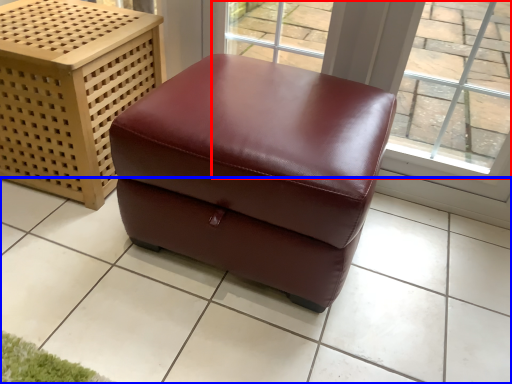
Question: Which object appears closest to the camera in this image, window (highlighted by a red box) or tile (highlighted by a blue box)?

Choices:
 (A) window
 (B) tile

Answer: (B)